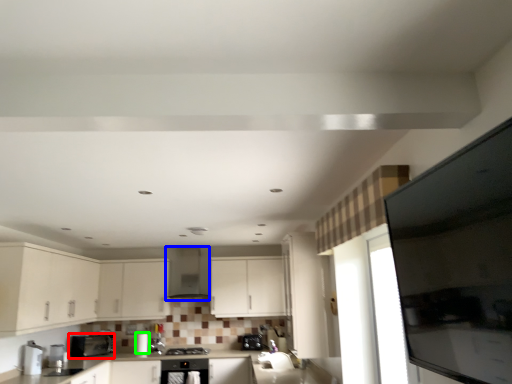
Question: Based on their relative distances, which object is nearer to home appliance (highlighted by a red box)? Choose from exhaust hood (highlighted by a blue box) and appliance (highlighted by a green box).

Choices:
 (A) exhaust hood
 (B) appliance

Answer: (B)